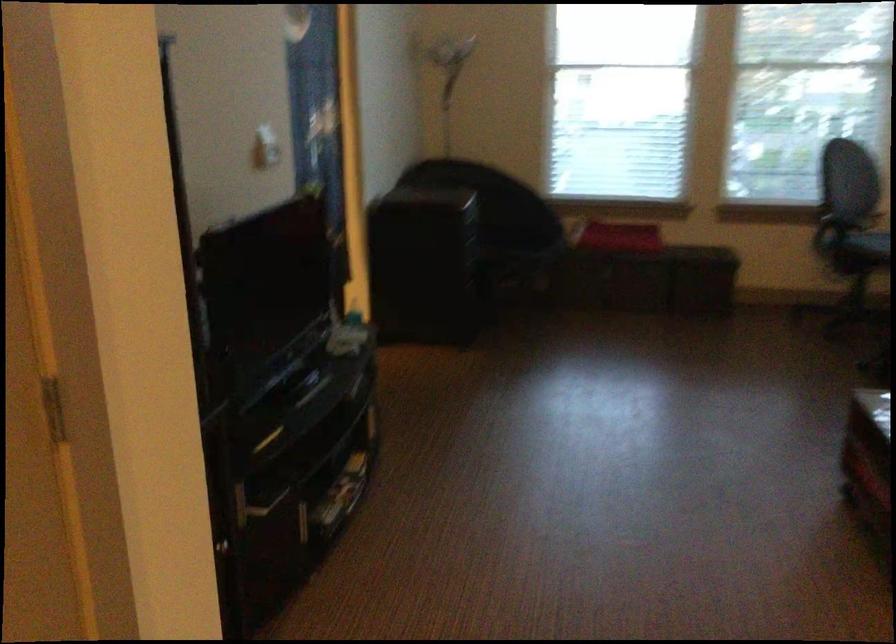
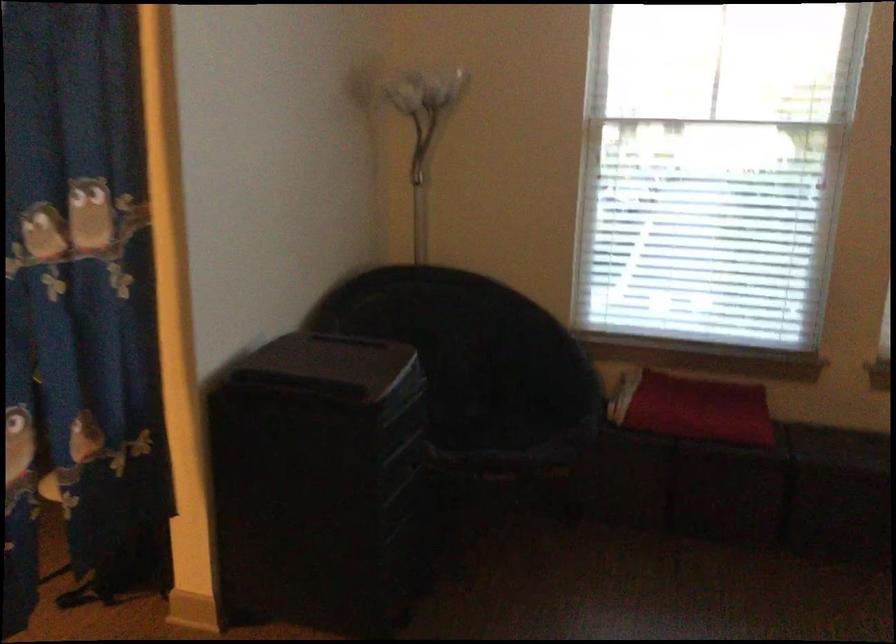
Question: What movement of the cameraman would produce the second image?

Choices:
 (A) Left
 (B) Right
 (C) Forward
 (D) Backward

Answer: (C)